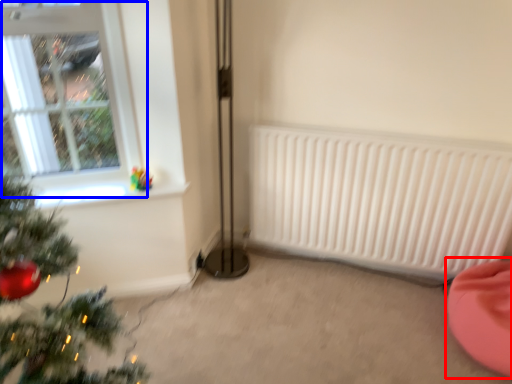
Question: Which object appears farthest to the camera in this image, bean bag chair (highlighted by a red box) or window (highlighted by a blue box)?

Choices:
 (A) bean bag chair
 (B) window

Answer: (B)